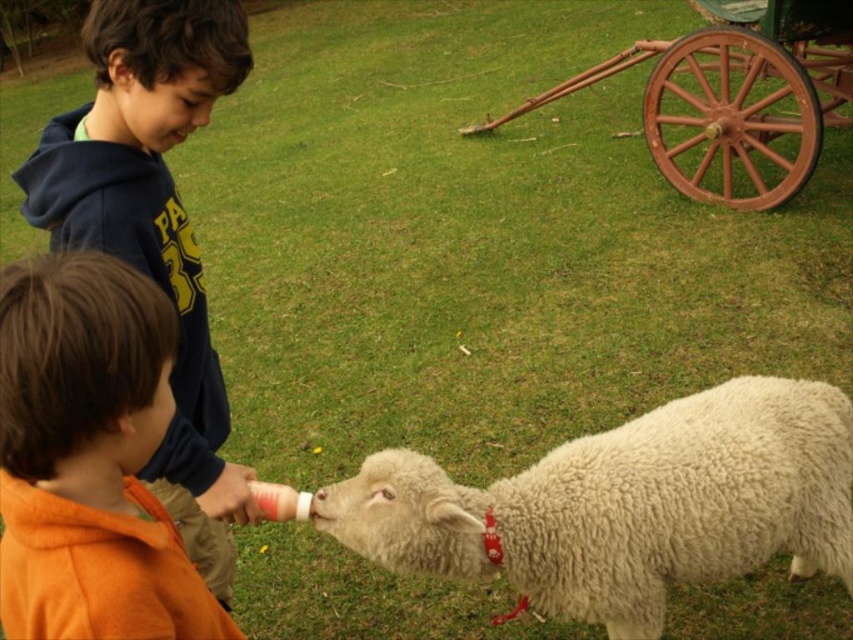
Who is more distant from viewer, (39, 484) or (718, 77)?

Point (718, 77)

Who is taller, orange fleece jacket at lower left or rusty wood wagon at upper right?

rusty wood wagon at upper right is taller.

Between point (126, 577) and point (682, 84), which one is positioned behind?

Point (682, 84)

The image size is (853, 640). I want to click on orange fleece jacket at lower left, so click(90, 458).

Does point (433, 490) lie in front of point (798, 109)?

Yes.

Identify the location of white fluffy sheep at lower center. (625, 504).

Describe the element at coordinates (625, 504) in the screenshot. I see `white fluffy sheep at lower center` at that location.

Where is `white fluffy sheep at lower center`? Image resolution: width=853 pixels, height=640 pixels. white fluffy sheep at lower center is located at coordinates (625, 504).

Who is shorter, white fluffy sheep at lower center or orange fleece jacket at lower left?

With less height is orange fleece jacket at lower left.

Is white fluffy sheep at lower center below orange fleece jacket at lower left?

Yes, white fluffy sheep at lower center is below orange fleece jacket at lower left.

Between point (627, 449) and point (27, 419), which one is positioned behind?

Positioned behind is point (627, 449).

At what (x,y) coordinates should I click in order to perform the action: click on white fluffy sheep at lower center. Please return your answer as a coordinate pair (x, y). Looking at the image, I should click on (625, 504).